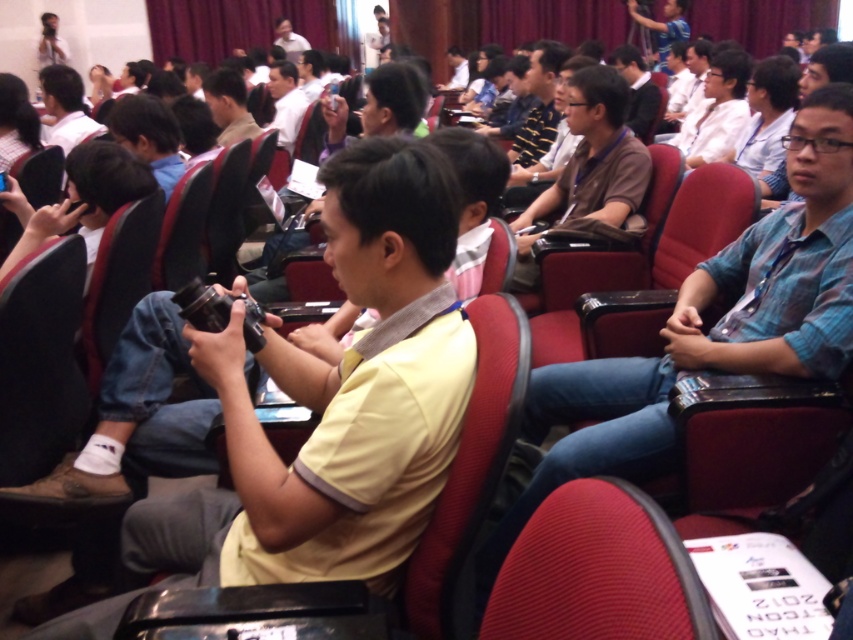
You are sitting in the conference room and want to take a photo of the presentation. The yellow matte shirt at center is blocking your view. Can you move the matte plastic chair at center to the side to get a better angle?

The yellow matte shirt at center is above the matte plastic chair at center, meaning the shirt is positioned higher than the chair. Since the shirt is blocking your view, moving the chair might not help as the obstruction is the shirt, not the chair itself.

You are organizing a photo shoot in this scene and need to position two subjects. The first subject is wearing a blue plaid shirt at right, and the second is wearing a white shirt at upper center. Based on the scene description, which subject requires more space for their pose?

The blue plaid shirt at right might require more space for their pose since they are wider than the white shirt at upper center.